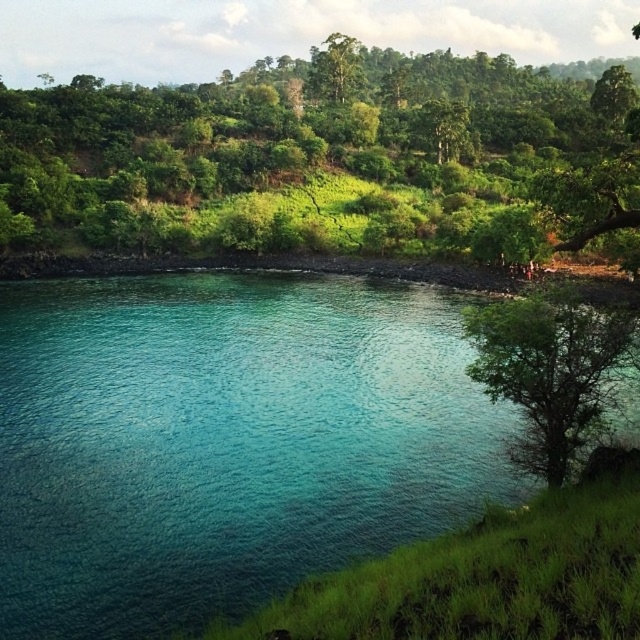
Question: Considering the relative positions of teal glossy water at center and green leafy tree at center in the image provided, where is teal glossy water at center located with respect to green leafy tree at center?

Choices:
 (A) right
 (B) left

Answer: (B)

Question: Does teal glossy water at center have a lesser width compared to green leafy tree at lower right?

Choices:
 (A) no
 (B) yes

Answer: (A)

Question: Which object is the farthest from the teal glossy water at center?

Choices:
 (A) green leafy tree at lower right
 (B) green leafy tree at center

Answer: (B)

Question: Which is nearer to the green leafy tree at lower right?

Choices:
 (A) green leafy tree at center
 (B) teal glossy water at center

Answer: (B)

Question: Is the position of teal glossy water at center less distant than that of green leafy tree at center?

Choices:
 (A) yes
 (B) no

Answer: (A)

Question: Which point appears closest to the camera in this image?

Choices:
 (A) (540, 433)
 (B) (600, 152)

Answer: (A)